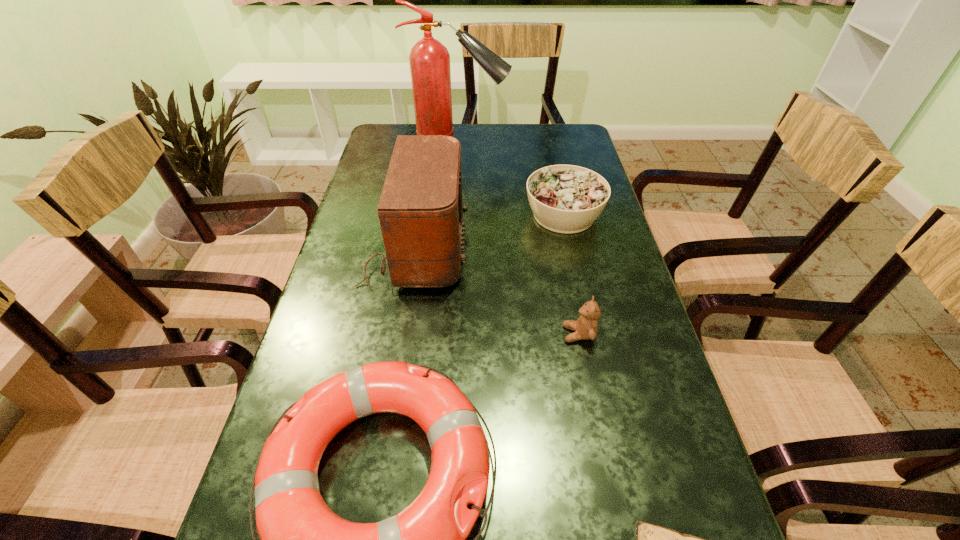
This screenshot has height=540, width=960. Find the location of `free point at the far right corner`. free point at the far right corner is located at coordinates (550, 152).

Locate an element on the screen. The height and width of the screenshot is (540, 960). free space that is in between the salad and the teddy bear is located at coordinates (571, 274).

This screenshot has height=540, width=960. I want to click on vacant area that lies between the radio receiver and the fourth farthest object, so click(497, 292).

I want to click on empty location between the fifth shortest object and the third nearest object, so click(x=497, y=292).

Identify which object is the third nearest to the life buoy. Please provide its 2D coordinates. Your answer should be formatted as a tuple, i.e. [(x, y)], where the tuple contains the x and y coordinates of a point satisfying the conditions above.

[(420, 210)]

Image resolution: width=960 pixels, height=540 pixels. I want to click on object that is the fifth closest one to the salad, so click(x=651, y=539).

Where is `blank space that satisfies the following two spatial constraints: 1. on the front side of the salad; 2. on the front panel of the fifth shortest object`? Image resolution: width=960 pixels, height=540 pixels. blank space that satisfies the following two spatial constraints: 1. on the front side of the salad; 2. on the front panel of the fifth shortest object is located at coordinates (571, 249).

Locate an element on the screen. The width and height of the screenshot is (960, 540). free point that satisfies the following two spatial constraints: 1. on the back side of the salad; 2. at the nozzle end of the fire extinguisher is located at coordinates (548, 143).